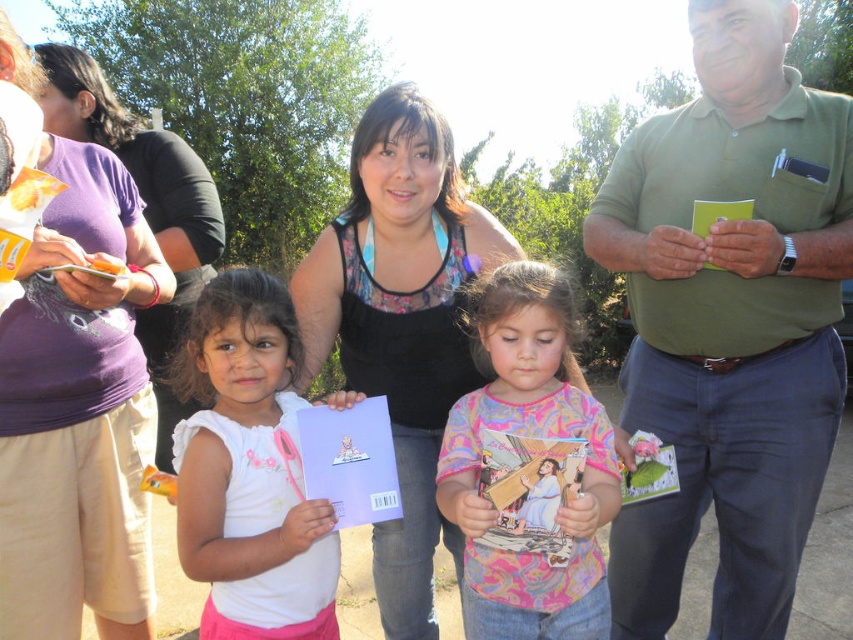
Can you confirm if green cotton shirt at center is bigger than purple fabric shirt at left?

Yes.

Which is behind, point (757, 605) or point (143, 352)?

The point (143, 352) is more distant.

At what (x,y) coordinates should I click in order to perform the action: click on green cotton shirt at center. Please return your answer as a coordinate pair (x, y). Looking at the image, I should click on (729, 321).

Can you confirm if white matte paper at center is taller than purple fabric shirt at left?

Incorrect, white matte paper at center's height is not larger of purple fabric shirt at left's.

Does white matte paper at center appear on the left side of purple fabric shirt at left?

No, white matte paper at center is not to the left of purple fabric shirt at left.

You are a GUI agent. You are given a task and a screenshot of the screen. Output one action in this format:
    pyautogui.click(x=<x>, y=<y>)
    Task: Click on the white matte paper at center
    
    Given the screenshot: What is the action you would take?
    pyautogui.click(x=248, y=468)

Between multicolored fabric shirt at center and purple fabric shirt at left, which one appears on the left side from the viewer's perspective?

Positioned to the left is purple fabric shirt at left.

Which is more to the right, multicolored fabric shirt at center or purple fabric shirt at left?

multicolored fabric shirt at center

Is point (589, 513) positioned before point (219, 212)?

That is True.

Identify the location of multicolored fabric shirt at center. This screenshot has width=853, height=640. (532, 468).